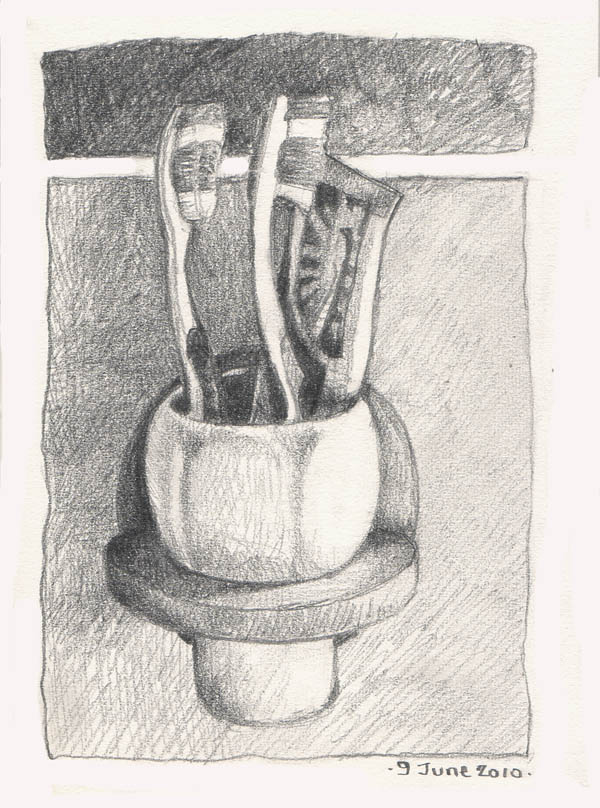
Locate an element on the screen. The height and width of the screenshot is (808, 600). toothbursh is located at coordinates (271, 284).